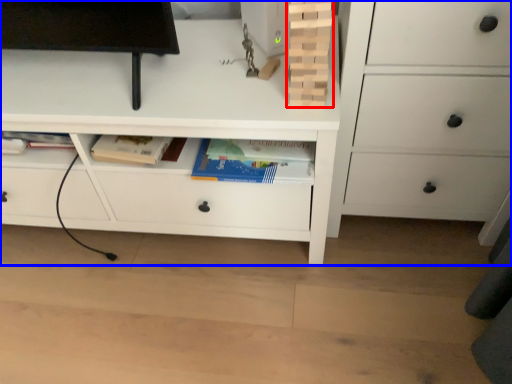
Question: Which of the following is the farthest to the observer, book (highlighted by a red box) or chest of drawers (highlighted by a blue box)?

Choices:
 (A) book
 (B) chest of drawers

Answer: (B)